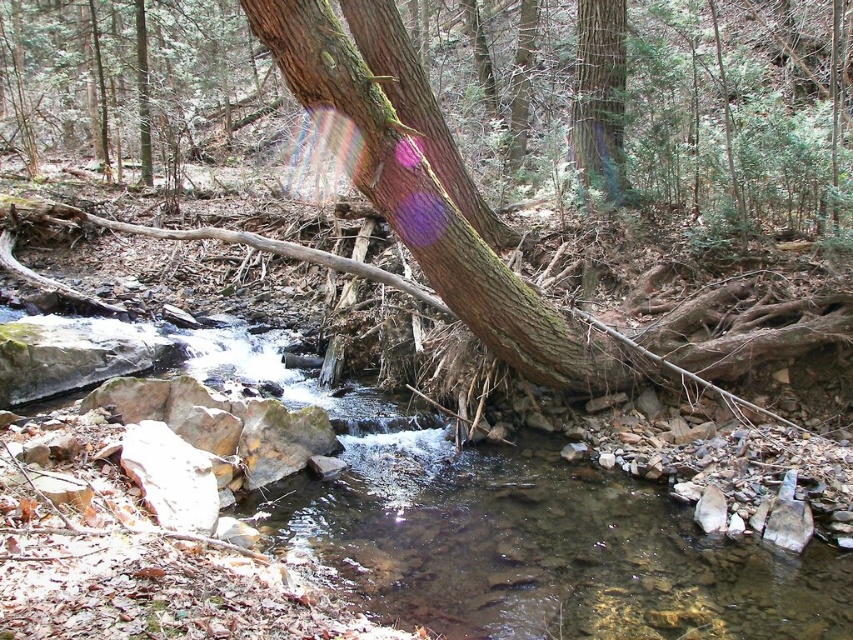
Question: Which of the following is the closest to the observer?

Choices:
 (A) (495, 545)
 (B) (611, 182)

Answer: (A)

Question: Which point is closer to the camera?

Choices:
 (A) green rough bark tree trunk at upper center
 (B) clear water stream at center

Answer: (B)

Question: Which point is closer to the camera?

Choices:
 (A) clear water stream at center
 (B) green rough bark tree trunk at upper center

Answer: (A)

Question: Does clear water stream at center have a larger size compared to green rough bark tree trunk at upper center?

Choices:
 (A) no
 (B) yes

Answer: (B)

Question: Does clear water stream at center have a greater width compared to green rough bark tree trunk at upper center?

Choices:
 (A) yes
 (B) no

Answer: (A)

Question: Is clear water stream at center to the right of green rough bark tree trunk at upper center from the viewer's perspective?

Choices:
 (A) yes
 (B) no

Answer: (B)